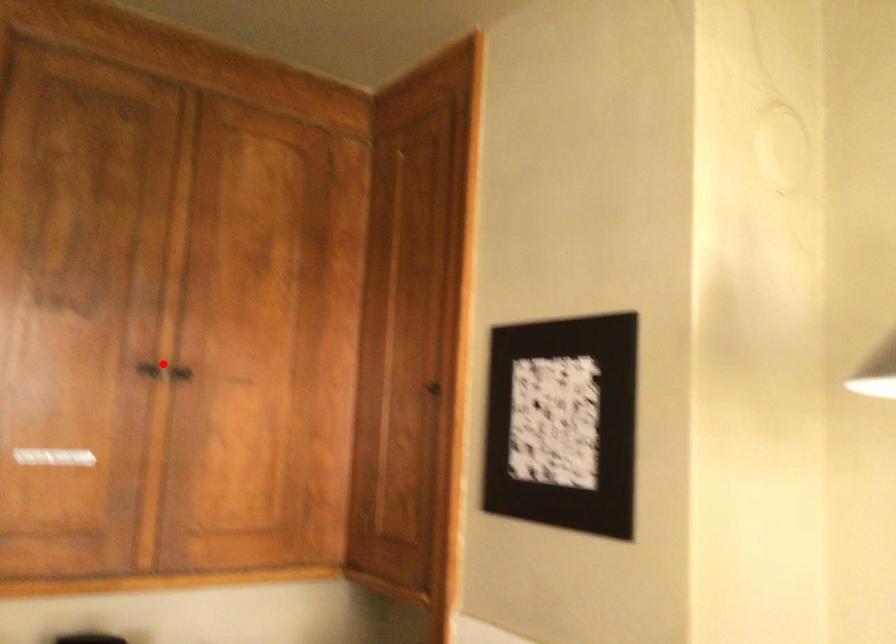
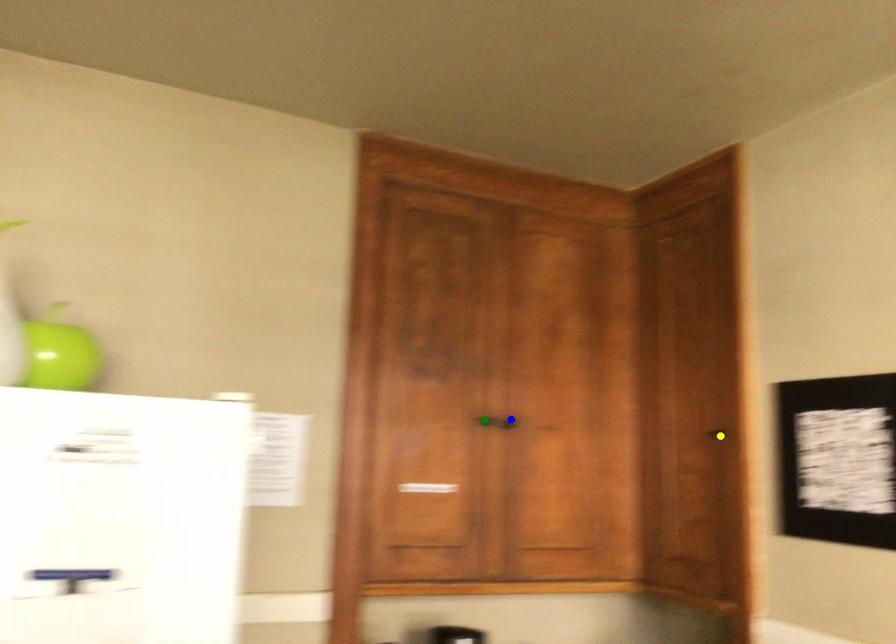
Question: I am providing you with two images of the same scene from different viewpoints. A red point is marked on the first image. You are given multiple points on the second image. Which spot in image 2 lines up with the point in image 1?

Choices:
 (A) green point
 (B) yellow point
 (C) blue point

Answer: (A)